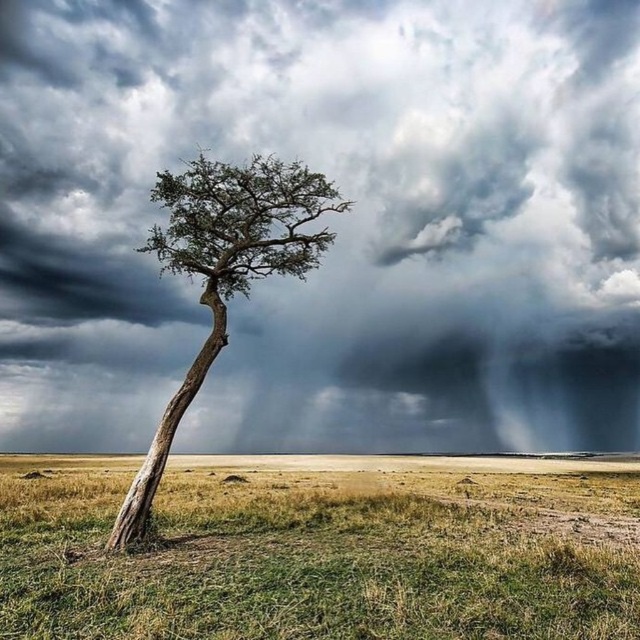
Is green grass at center behind green textured tree at center?

That is False.

Find the location of a particular element. Image resolution: width=640 pixels, height=640 pixels. green grass at center is located at coordinates (323, 548).

Between point (196, 509) and point (240, 237), which one is positioned behind?

The point (196, 509) is behind.

The image size is (640, 640). I want to click on green grass at center, so click(x=323, y=548).

Can you confirm if dark gray cloud at upper center is positioned to the right of green grass at center?

Correct, you'll find dark gray cloud at upper center to the right of green grass at center.

Identify the location of dark gray cloud at upper center. (333, 224).

Which is in front, point (336, 410) or point (193, 262)?

Point (193, 262) is more forward.

Is dark gray cloud at upper center shorter than green textured tree at center?

In fact, dark gray cloud at upper center may be taller than green textured tree at center.

Is point (582, 333) positioned before point (291, 252)?

No, it is not.

Identify the location of dark gray cloud at upper center. (333, 224).